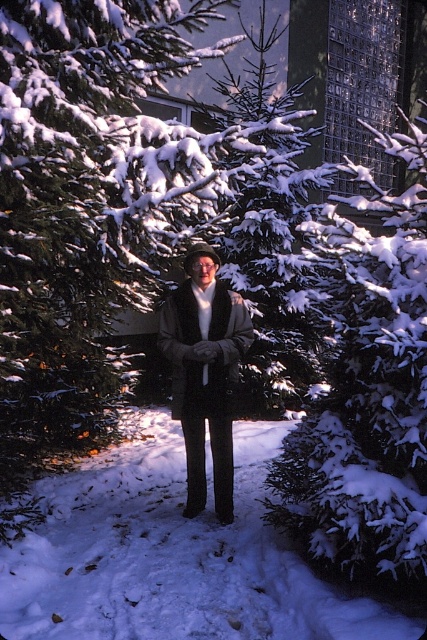
Can you confirm if white fluffy snow at center is taller than snow-covered evergreen at center?

Incorrect, white fluffy snow at center's height is not larger of snow-covered evergreen at center's.

Between white fluffy snow at center and snow-covered evergreen at center, which one appears on the right side from the viewer's perspective?

snow-covered evergreen at center is more to the right.

Which is behind, point (158, 548) or point (350, 292)?

Positioned behind is point (158, 548).

Identify the location of white fluffy snow at center. (172, 556).

Can you confirm if snow-covered evergreen at center is thinner than dark gray wool coat at center?

No.

Where is `snow-covered evergreen at center`? The image size is (427, 640). snow-covered evergreen at center is located at coordinates (366, 385).

At what (x,y) coordinates should I click in order to perform the action: click on snow-covered evergreen at center. Please return your answer as a coordinate pair (x, y). Image resolution: width=427 pixels, height=640 pixels. Looking at the image, I should click on (366, 385).

Looking at this image, does white fluffy snow at center appear on the left side of dark gray wool coat at center?

Yes, white fluffy snow at center is to the left of dark gray wool coat at center.

Who is more forward, (140, 625) or (181, 284)?

Point (140, 625)

I want to click on white fluffy snow at center, so click(x=172, y=556).